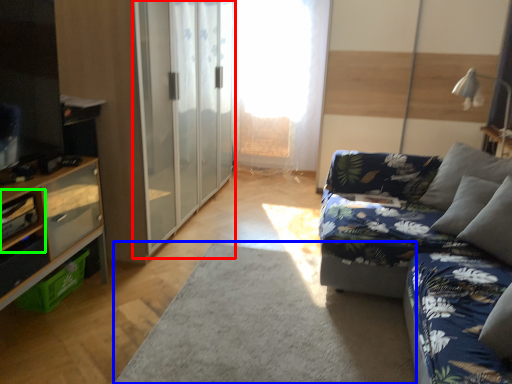
Question: Which object is the farthest from barn door (highlighted by a red box)? Choose among these: plain (highlighted by a blue box) or shelf (highlighted by a green box).

Choices:
 (A) plain
 (B) shelf

Answer: (B)